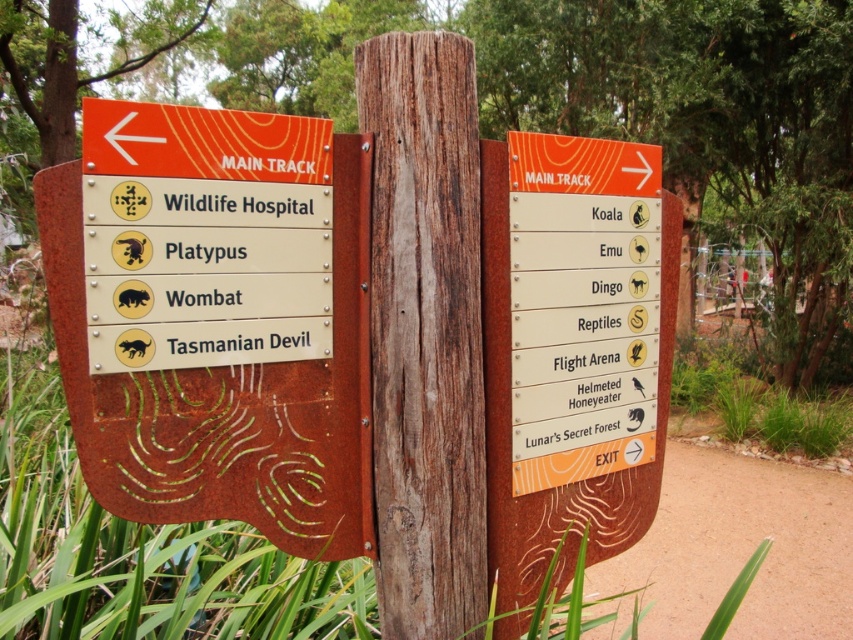
You are standing in front of the signpost and want to read both the rusty metal sign at left and the orange wood sign at right. Which one will you see first without moving your head?

The rusty metal sign at left will be seen first because it is positioned in front of the orange wood sign at right, making it closer to your line of sight.

You are standing in front of the signpost and want to read the destinations listed on the rusty metal sign at left. Since the weathered wood post at center is in your way, can you move around it to get a better view?

The rusty metal sign at left is located above the weathered wood post at center, so you can move around the post to see the sign clearly without obstruction.

You are a park visitor holding a 12 inch long map. You want to place it between the weathered wood post at center and the orange wood sign at right. Will the map fit without overlapping either object?

The distance between the weathered wood post at center and the orange wood sign at right is 13.71 inches. Since the map is 12 inches long, it will fit between them without overlapping either object.